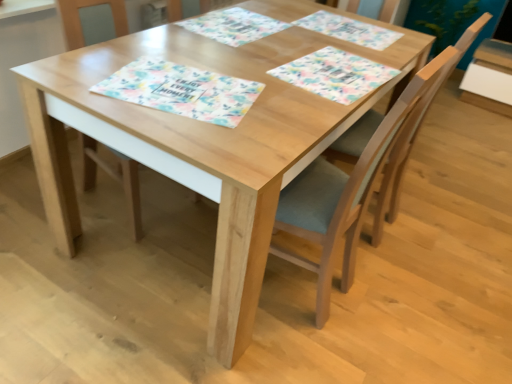
The image size is (512, 384). In order to click on vacant location below floral paper placemat at upper center, the third place mat in the front-to-back sequence (from a real-world perspective) in this screenshot , I will do `click(242, 24)`.